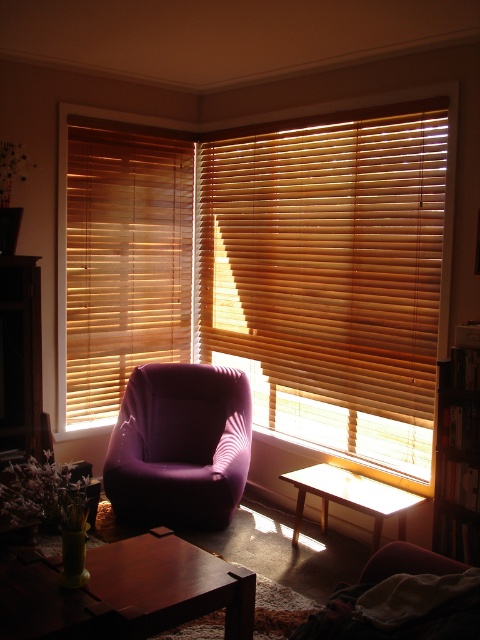
Question: Does wooden blinds at center appear under purple fabric couch at lower right?

Choices:
 (A) no
 (B) yes

Answer: (A)

Question: Does wooden blinds at left lie behind brown wooden bookshelf at right?

Choices:
 (A) yes
 (B) no

Answer: (A)

Question: Which of the following is the closest to the observer?

Choices:
 (A) (467, 384)
 (B) (83, 156)
 (C) (155, 468)

Answer: (A)

Question: Which point is closer to the camera?

Choices:
 (A) (342, 323)
 (B) (445, 560)

Answer: (B)

Question: Which is farther from the purple fabric armchair at center?

Choices:
 (A) wooden blinds at center
 (B) brown wooden bookshelf at right

Answer: (B)

Question: Is wooden blinds at left further to the viewer compared to brown wooden bookshelf at right?

Choices:
 (A) yes
 (B) no

Answer: (A)